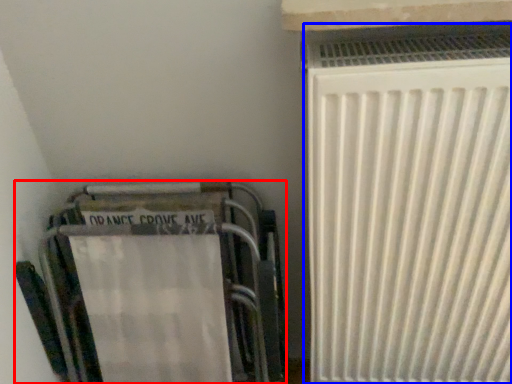
Question: Among these objects, which one is nearest to the camera, furniture (highlighted by a red box) or radiator (highlighted by a blue box)?

Choices:
 (A) furniture
 (B) radiator

Answer: (B)